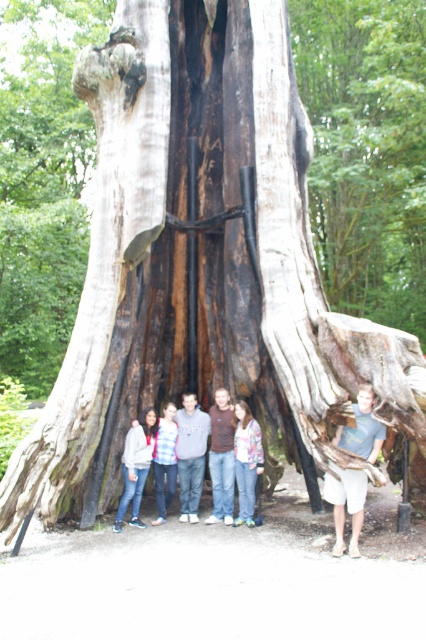
Is brown matte shirt at center shorter than striped sweater at center?

Incorrect, brown matte shirt at center's height does not fall short of striped sweater at center's.

Is point (224, 413) farther from camera compared to point (238, 412)?

Yes, point (224, 413) is farther from viewer.

I want to click on brown matte shirt at center, so click(x=221, y=458).

You are a GUI agent. You are given a task and a screenshot of the screen. Output one action in this format:
    pyautogui.click(x=<x>, y=<y>)
    Task: Click on the brown matte shirt at center
    
    Given the screenshot: What is the action you would take?
    pyautogui.click(x=221, y=458)

Consider the image. Who is positioned more to the left, gray sweater at center or blue denim jeans at center?

blue denim jeans at center is more to the left.

Who is positioned more to the right, gray sweater at center or blue denim jeans at center?

gray sweater at center

The image size is (426, 640). Find the location of `gray sweater at center`. gray sweater at center is located at coordinates (190, 454).

Locate an element on the screen. The image size is (426, 640). gray sweater at center is located at coordinates (190, 454).

Does matte gray hoodie at lower left have a lesser height compared to blue denim jeans at center?

Yes.

Does matte gray hoodie at lower left have a greater width compared to blue denim jeans at center?

Correct, the width of matte gray hoodie at lower left exceeds that of blue denim jeans at center.

Is point (129, 451) closer to camera compared to point (170, 476)?

Yes, it is in front of point (170, 476).

The height and width of the screenshot is (640, 426). What are the coordinates of `matte gray hoodie at lower left` in the screenshot? It's located at (135, 465).